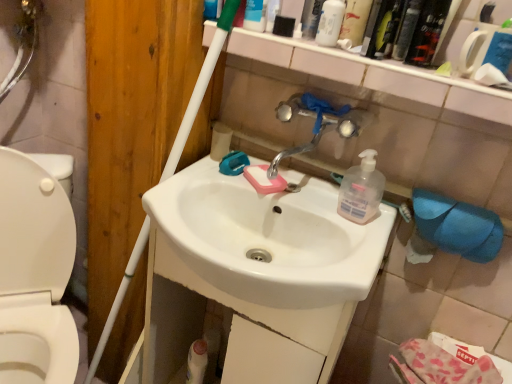
The height and width of the screenshot is (384, 512). Describe the element at coordinates (426, 32) in the screenshot. I see `black plastic mouthwash at upper right, the first mouthwash from the right` at that location.

This screenshot has width=512, height=384. I want to click on white glossy toilet at left, so click(x=35, y=274).

Describe the element at coordinates (35, 274) in the screenshot. The image size is (512, 384). I see `white glossy toilet at left` at that location.

What do you see at coordinates (386, 29) in the screenshot? I see `translucent plastic mouthwash at upper right, the 3th mouthwash positioned from the right` at bounding box center [386, 29].

Where is `translucent plastic mouthwash at upper right, the 3th mouthwash positioned from the right`? translucent plastic mouthwash at upper right, the 3th mouthwash positioned from the right is located at coordinates (386, 29).

What is the approximate width of green plastic bottle at upper right, acting as the second mouthwash starting from the left?

It is 3.03 inches.

What are the coordinates of `blue fabric toilet paper at lower right, acting as the 2th toilet paper starting from the left` in the screenshot? It's located at (457, 226).

Would you say white matte bottle at upper center, the 2th cleaning product positioned from the bottom, is outside white glossy sink at center?

Yes, white matte bottle at upper center, the 2th cleaning product positioned from the bottom, is not within white glossy sink at center.

Is white matte bottle at upper center, the 2th cleaning product positioned from the bottom, positioned far away from white glossy sink at center?

white matte bottle at upper center, the 2th cleaning product positioned from the bottom, is actually quite close to white glossy sink at center.

Considering the sizes of objects white matte bottle at upper center, which is counted as the 1th cleaning product, starting from the top, and white glossy sink at center in the image provided, who is smaller, white matte bottle at upper center, which is counted as the 1th cleaning product, starting from the top, or white glossy sink at center?

white matte bottle at upper center, which is counted as the 1th cleaning product, starting from the top.

Does white matte bottle at upper center, which is counted as the 1th cleaning product, starting from the top, turn towards white glossy sink at center?

No, white matte bottle at upper center, which is counted as the 1th cleaning product, starting from the top, is not oriented towards white glossy sink at center.

Is translucent plastic soap dispenser at center-right, which is counted as the first cleaning product, starting from the bottom, taller or shorter than white glossy toilet at left?

Clearly, translucent plastic soap dispenser at center-right, which is counted as the first cleaning product, starting from the bottom, is shorter compared to white glossy toilet at left.

Based on the photo, is translucent plastic soap dispenser at center-right, acting as the second cleaning product starting from the top, facing away from white glossy toilet at left?

No, translucent plastic soap dispenser at center-right, acting as the second cleaning product starting from the top, is not facing the opposite direction of white glossy toilet at left.

Which object is closer to the camera, translucent plastic soap dispenser at center-right, acting as the second cleaning product starting from the top, or white glossy toilet at left?

white glossy toilet at left is in front.

Between translucent plastic soap dispenser at center-right, which is counted as the first cleaning product, starting from the bottom, and white glossy toilet at left, which one appears on the right side from the viewer's perspective?

From the viewer's perspective, translucent plastic soap dispenser at center-right, which is counted as the first cleaning product, starting from the bottom, appears more on the right side.

Is white glossy toilet at left aimed at white plastic bottle at upper center, the 1th toiletry from the left?

No.

Considering the relative sizes of white glossy toilet at left and white plastic bottle at upper center, marked as the second toiletry in a right-to-left arrangement, in the image provided, is white glossy toilet at left smaller than white plastic bottle at upper center, marked as the second toiletry in a right-to-left arrangement,?

Incorrect, white glossy toilet at left is not smaller in size than white plastic bottle at upper center, marked as the second toiletry in a right-to-left arrangement.

Considering the positions of objects white glossy toilet at left and white plastic bottle at upper center, marked as the second toiletry in a right-to-left arrangement, in the image provided, who is more to the left, white glossy toilet at left or white plastic bottle at upper center, marked as the second toiletry in a right-to-left arrangement,?

From the viewer's perspective, white glossy toilet at left appears more on the left side.

Looking at this image, would you say white glossy toilet at left is inside or outside white plastic bottle at upper center, the 1th toiletry from the left?

white glossy toilet at left is not inside white plastic bottle at upper center, the 1th toiletry from the left, it's outside.

From the image's perspective, is green plastic bottle at upper right, acting as the second mouthwash starting from the left, above translucent plastic soap dispenser at center-right, which is counted as the first cleaning product, starting from the bottom?

Yes, from the image's perspective, green plastic bottle at upper right, acting as the second mouthwash starting from the left, is over translucent plastic soap dispenser at center-right, which is counted as the first cleaning product, starting from the bottom.

Considering the relative sizes of green plastic bottle at upper right, placed as the second mouthwash when sorted from right to left, and translucent plastic soap dispenser at center-right, acting as the second cleaning product starting from the top, in the image provided, is green plastic bottle at upper right, placed as the second mouthwash when sorted from right to left, wider than translucent plastic soap dispenser at center-right, acting as the second cleaning product starting from the top,?

No.

From a real-world perspective, who is located lower, green plastic bottle at upper right, placed as the second mouthwash when sorted from right to left, or translucent plastic soap dispenser at center-right, which is counted as the first cleaning product, starting from the bottom?

From a 3D spatial view, translucent plastic soap dispenser at center-right, which is counted as the first cleaning product, starting from the bottom, is below.

At what (x,y) coordinates should I click in order to perform the action: click on cleaning product that is the 1st object to the right of the chrome metallic faucet at center, starting at the anchor. Please return your answer as a coordinate pair (x, y). Image resolution: width=512 pixels, height=384 pixels. Looking at the image, I should click on (330, 23).

Looking at this image, is chrome metallic faucet at center next to white matte bottle at upper center, the 2th cleaning product positioned from the bottom, and touching it?

chrome metallic faucet at center is not next to white matte bottle at upper center, the 2th cleaning product positioned from the bottom, and they're not touching.

From a real-world perspective, does chrome metallic faucet at center sit lower than white matte bottle at upper center, the 2th cleaning product positioned from the bottom?

Yes, from a real-world perspective, chrome metallic faucet at center is beneath white matte bottle at upper center, the 2th cleaning product positioned from the bottom.

Considering the sizes of chrome metallic faucet at center and white matte bottle at upper center, which is counted as the 1th cleaning product, starting from the top, in the image, is chrome metallic faucet at center bigger or smaller than white matte bottle at upper center, which is counted as the 1th cleaning product, starting from the top,?

chrome metallic faucet at center is bigger than white matte bottle at upper center, which is counted as the 1th cleaning product, starting from the top.

You are a GUI agent. You are given a task and a screenshot of the screen. Output one action in this format:
    pyautogui.click(x=<x>, y=<y>)
    Task: Click on the 1st cleaning product positioned below the metallic silver canister at upper center, the 1th toiletry viewed from the right (from a real-world perspective)
    
    Given the screenshot: What is the action you would take?
    pyautogui.click(x=330, y=23)

Which object is wider, metallic silver canister at upper center, the 1th toiletry viewed from the right, or white matte bottle at upper center, the 2th cleaning product positioned from the bottom?

With larger width is white matte bottle at upper center, the 2th cleaning product positioned from the bottom.

From the image's perspective, which object appears higher, metallic silver canister at upper center, the 1th toiletry viewed from the right, or white matte bottle at upper center, which is counted as the 1th cleaning product, starting from the top?

From the image's view, metallic silver canister at upper center, the 1th toiletry viewed from the right, is above.

Is metallic silver canister at upper center, the 1th toiletry viewed from the right, next to white matte bottle at upper center, the 2th cleaning product positioned from the bottom, and touching it?

Yes, metallic silver canister at upper center, the 1th toiletry viewed from the right, is next to white matte bottle at upper center, the 2th cleaning product positioned from the bottom.

Visually, is blue fabric toilet paper at lower right, the 1th toilet paper when ordered from bottom to top, positioned to the left or to the right of green plastic bottle at upper right, acting as the second mouthwash starting from the left?

blue fabric toilet paper at lower right, the 1th toilet paper when ordered from bottom to top, is to the right of green plastic bottle at upper right, acting as the second mouthwash starting from the left.

From a real-world perspective, is blue fabric toilet paper at lower right, which is counted as the 2th toilet paper, starting from the back, above or below green plastic bottle at upper right, acting as the second mouthwash starting from the left?

blue fabric toilet paper at lower right, which is counted as the 2th toilet paper, starting from the back, is below green plastic bottle at upper right, acting as the second mouthwash starting from the left.

Locate an element on the screen. The image size is (512, 384). mouthwash that is the 2nd object to the left of the blue fabric toilet paper at lower right, which is counted as the 2th toilet paper, starting from the back, starting at the anchor is located at coordinates (406, 29).

I want to click on cleaning product that is the 2nd object located above the white glossy sink at center (from the image's perspective), so click(x=330, y=23).

Find the location of `cleaning product that is the 2nd one when counting backward from the white glossy toilet at left`. cleaning product that is the 2nd one when counting backward from the white glossy toilet at left is located at coordinates (361, 190).

Which object lies further to the anchor point white matte toilet paper at upper center, which ranks as the second toilet paper in front-to-back order, white matte bottle at upper center, the 2th cleaning product positioned from the bottom, or metallic silver canister at upper center, the 1th toiletry viewed from the right?

white matte bottle at upper center, the 2th cleaning product positioned from the bottom.

From the image, which object appears to be farther from metallic silver canister at upper center, which is counted as the 2th toiletry, starting from the left, translucent plastic mouthwash at upper right, the 3th mouthwash positioned from the right, or white matte toilet paper at upper center, the second toilet paper in the bottom-to-top sequence?

white matte toilet paper at upper center, the second toilet paper in the bottom-to-top sequence.

Considering their positions, is white glossy toilet at left positioned closer to black plastic mouthwash at upper right, the first mouthwash from the right, than chrome metallic faucet at center?

Among the two, chrome metallic faucet at center is located nearer to black plastic mouthwash at upper right, the first mouthwash from the right.

Which object lies nearer to the anchor point black plastic mouthwash at upper right, the first mouthwash from the right, chrome metallic faucet at center or white glossy sink at center?

The object closer to black plastic mouthwash at upper right, the first mouthwash from the right, is chrome metallic faucet at center.

Based on their spatial positions, is metallic silver faucet at upper center or white matte toilet paper at upper center, the 1th toilet paper from the left, closer to white glossy sink at center?

white matte toilet paper at upper center, the 1th toilet paper from the left, is positioned closer to the anchor white glossy sink at center.

When comparing their distances from white matte toilet paper at upper center, arranged as the first toilet paper when viewed from the back, does translucent plastic soap dispenser at center-right, acting as the second cleaning product starting from the top, or white matte bottle at upper center, which is counted as the 1th cleaning product, starting from the top, seem further?

white matte bottle at upper center, which is counted as the 1th cleaning product, starting from the top, is further to white matte toilet paper at upper center, arranged as the first toilet paper when viewed from the back.

Based on their spatial positions, is white glossy sink at center or translucent plastic mouthwash at upper right, the 3th mouthwash positioned from the right, closer to white glossy toilet at left?

white glossy sink at center.

Based on their spatial positions, is green plastic bottle at upper right, acting as the second mouthwash starting from the left, or white plastic bottle at upper center, marked as the second toiletry in a right-to-left arrangement, closer to metallic silver faucet at upper center?

green plastic bottle at upper right, acting as the second mouthwash starting from the left, is closer to metallic silver faucet at upper center.

Locate an element on the screen. balustrade that lies between white matte bottle at upper center, which is counted as the 1th cleaning product, starting from the top, and white glossy sink at center from top to bottom is located at coordinates (375, 75).

This screenshot has width=512, height=384. In order to click on mouthwash between white matte bottle at upper center, the 2th cleaning product positioned from the bottom, and green plastic bottle at upper right, acting as the second mouthwash starting from the left in this screenshot , I will do `click(386, 29)`.

In order to click on toiletry between metallic silver canister at upper center, the 1th toiletry viewed from the right, and chrome metallic faucet at center from top to bottom in this screenshot , I will do `click(255, 15)`.

Image resolution: width=512 pixels, height=384 pixels. What are the coordinates of `cleaning product between white matte bottle at upper center, the 2th cleaning product positioned from the bottom, and blue fabric toilet paper at lower right, acting as the 2th toilet paper starting from the left, in the up-down direction` in the screenshot? It's located at (361, 190).